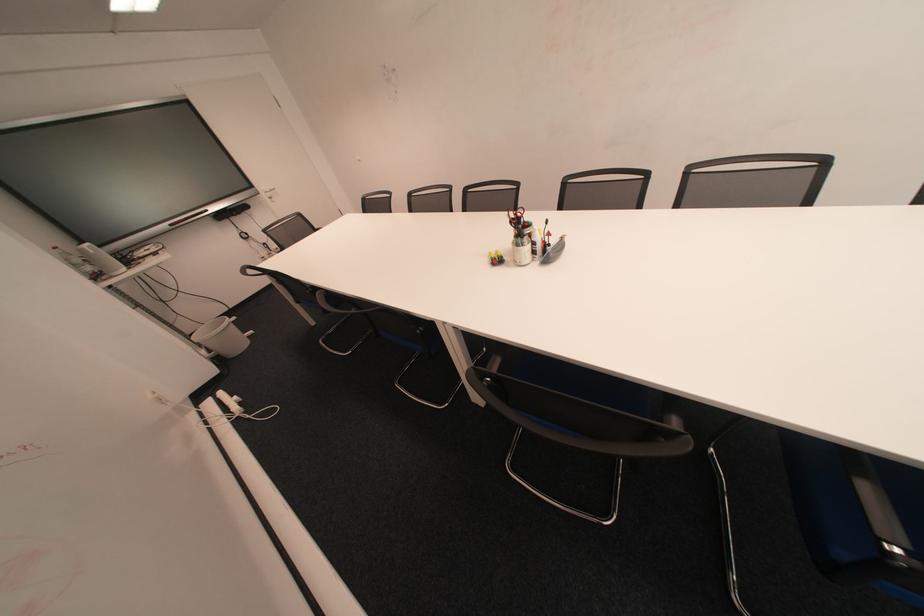
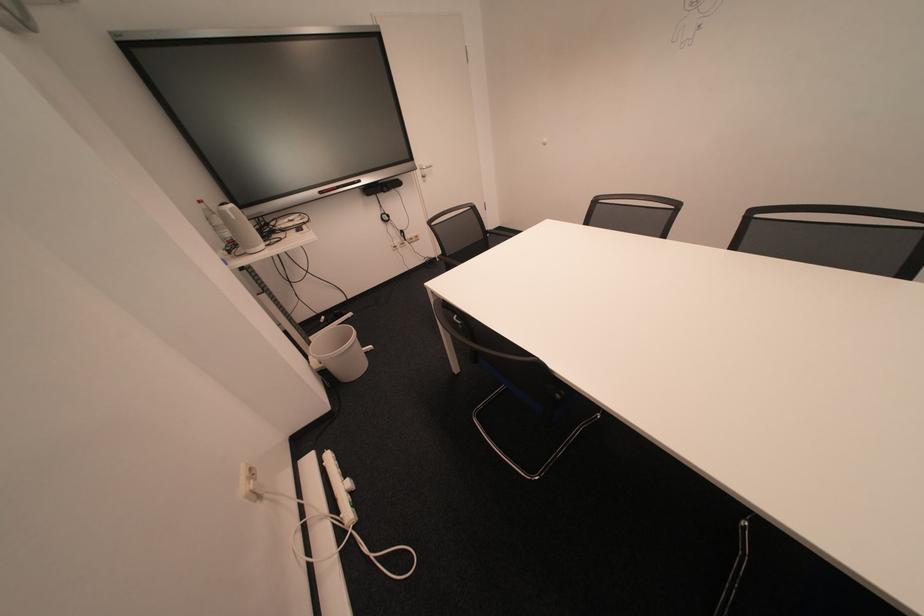
What movement of the cameraman would produce the second image?

The movement direction of the cameraman is left, forward.